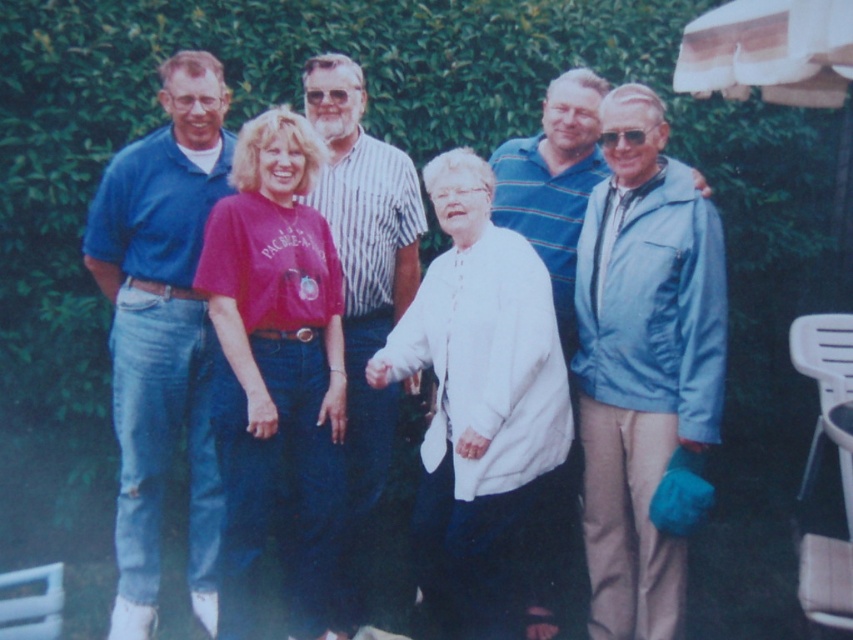
You are standing in the garden and want to take a photo of the matte blue polo shirt at left and the blue striped shirt at center. Which one is closer to the front of the group?

The matte blue polo shirt at left is positioned under the blue striped shirt at center, so the blue striped shirt at center is closer to the front of the group.

You are standing in the garden and want to take a photo of the matte blue polo shirt at left and the blue striped shirt at center. Which one is closer to the camera?

The matte blue polo shirt at left is in front of the blue striped shirt at center, so it is closer to the camera.